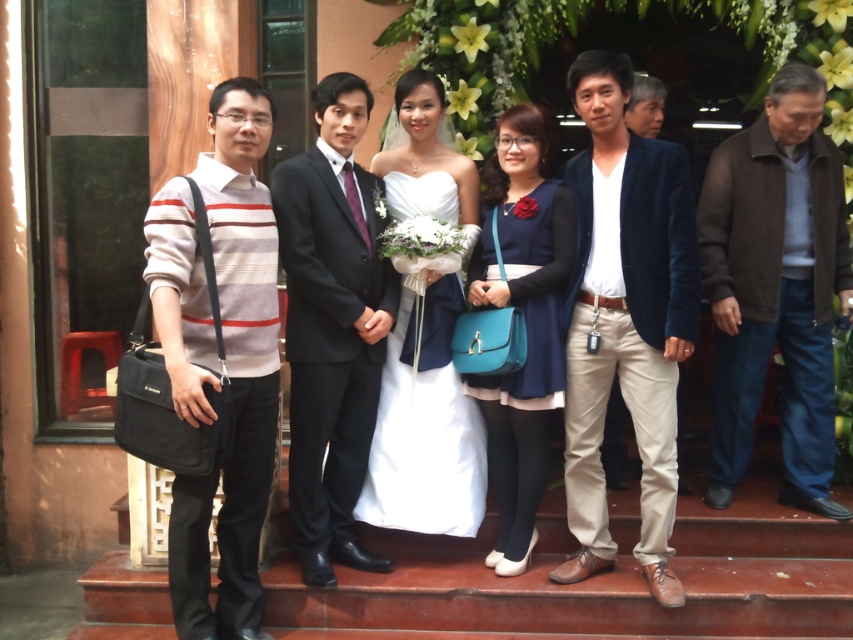
Question: Which point appears closest to the camera in this image?

Choices:
 (A) (438, 307)
 (B) (817, 362)
 (C) (344, 176)

Answer: (C)

Question: Among these objects, which one is nearest to the camera?

Choices:
 (A) striped sweater at left
 (B) black satin suit at center
 (C) white satin dress at center

Answer: (A)

Question: Based on their relative distances, which object is farther from the black satin suit at center?

Choices:
 (A) brown woolen jacket at right
 (B) white satin dress at center
 (C) velvet blue blazer at center

Answer: (A)

Question: Is white satin dress at center to the left of blue fabric dress at center from the viewer's perspective?

Choices:
 (A) yes
 (B) no

Answer: (A)

Question: Can you confirm if brown woolen jacket at right is bigger than blue fabric dress at center?

Choices:
 (A) yes
 (B) no

Answer: (A)

Question: Is brown woolen jacket at right thinner than blue fabric dress at center?

Choices:
 (A) no
 (B) yes

Answer: (A)